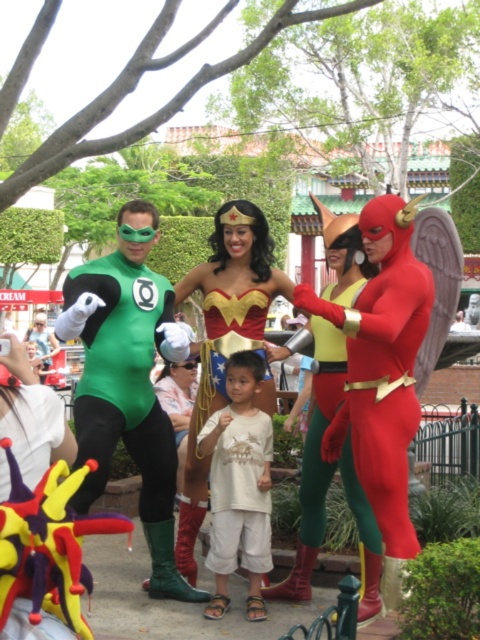
You are a photographer at the event and need to arrange the superheroes so that the shiny red suit at right and the white cotton shirt at center are visible in the frame. Based on their current positions, which superhero should be moved to the left to ensure both are fully visible?

The shiny red suit at right should be moved to the left to ensure both the shiny red suit at right and the white cotton shirt at center are fully visible in the frame.

You are standing at the center of the image. Which direction should you look to see the green spandex suit at left?

The green spandex suit at left is located at point (x=128, y=381), so you should look to the left side of the image to see it.

You are a photographer trying to adjust the lighting for a group photo. You notice two Green Lantern costumes in the frame. The first is the green spandex suit at left, and the second is the shiny green costume at center. Which costume should you focus on if you want to ensure the larger Green Lantern costume is properly lit?

The shiny green costume at center is larger than the green spandex suit at left, so you should focus on lighting the shiny green costume at center to ensure proper illumination for the larger costume.